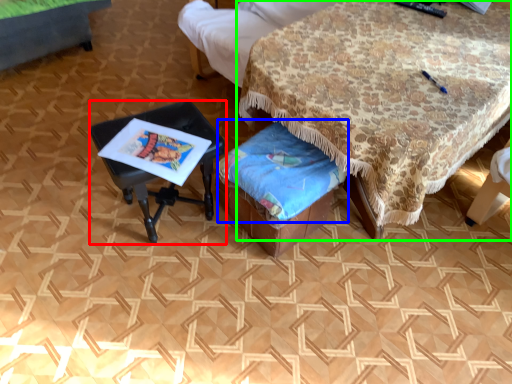
Question: Which object is the farthest from table (highlighted by a red box)? Choose among these: blanket (highlighted by a blue box) or table (highlighted by a green box).

Choices:
 (A) blanket
 (B) table

Answer: (B)